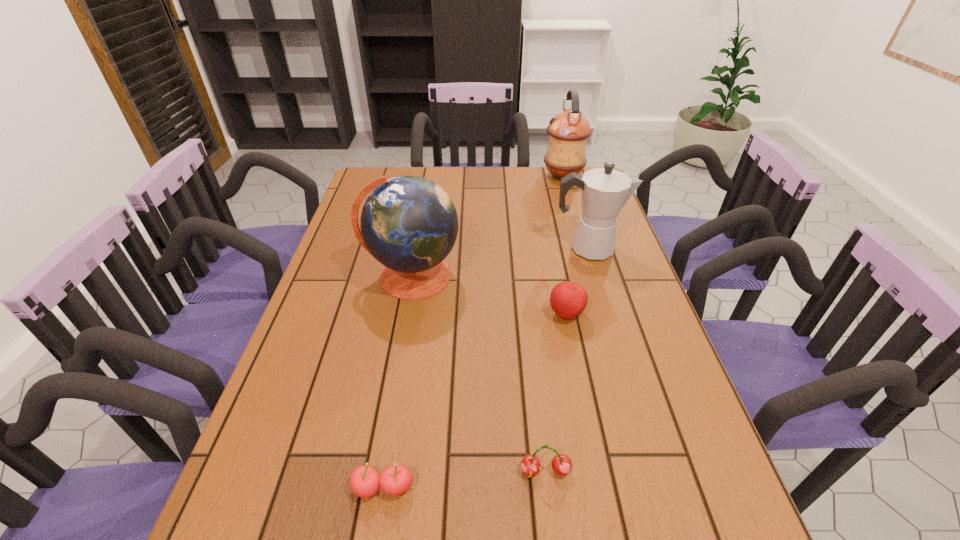
Find the location of a particular element. the farthest object is located at coordinates (568, 131).

Locate an element on the screen. Image resolution: width=960 pixels, height=540 pixels. globe is located at coordinates (409, 224).

Where is `coffeepot`? This screenshot has height=540, width=960. coffeepot is located at coordinates (605, 191).

The image size is (960, 540). In order to click on apple in this screenshot , I will do `click(568, 300)`.

Identify the location of the fourth object from right to left. (530, 465).

The image size is (960, 540). Identify the location of the left cherry. (365, 481).

Find the location of a particular element. The height and width of the screenshot is (540, 960). blank area located on the front of the farthest object is located at coordinates (580, 233).

This screenshot has height=540, width=960. What are the coordinates of `vacant space located 0.370m with the Americas facing the viewer on the globe` in the screenshot? It's located at (384, 433).

Find the location of `vacant space situated 0.160m on the back of the coffeepot`. vacant space situated 0.160m on the back of the coffeepot is located at coordinates (577, 210).

The image size is (960, 540). Identify the location of free location located on the front of the apple. (590, 435).